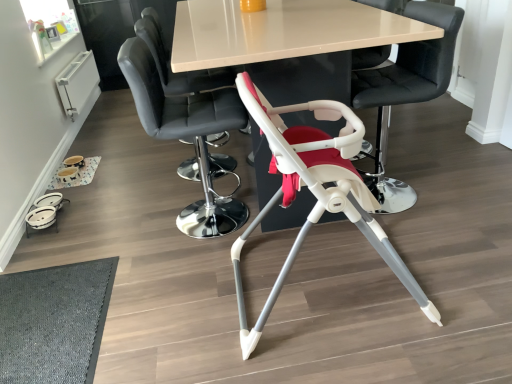
Locate an element on the screen. The height and width of the screenshot is (384, 512). vacant space to the right of white plastic highchair at center, placed as the second chair when sorted from right to left is located at coordinates click(x=452, y=261).